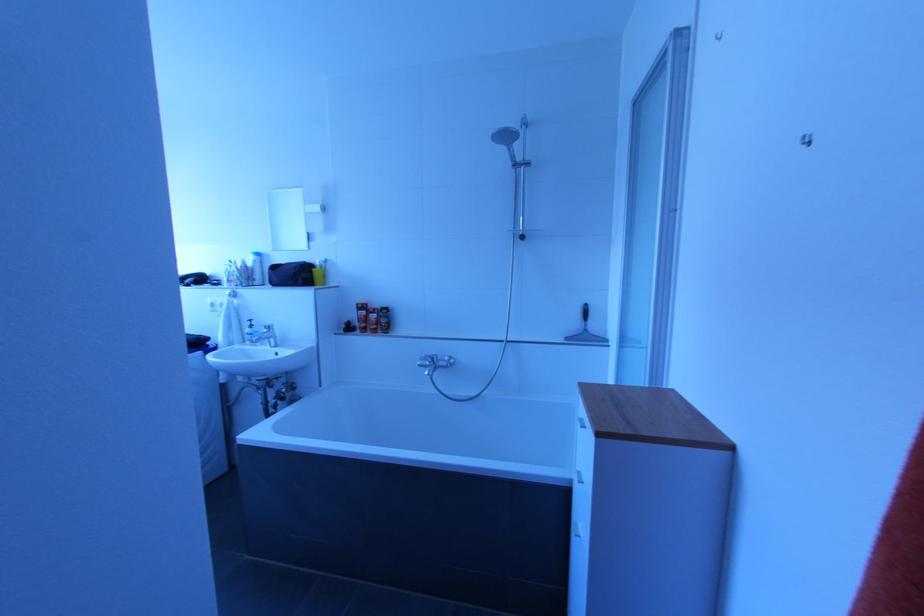
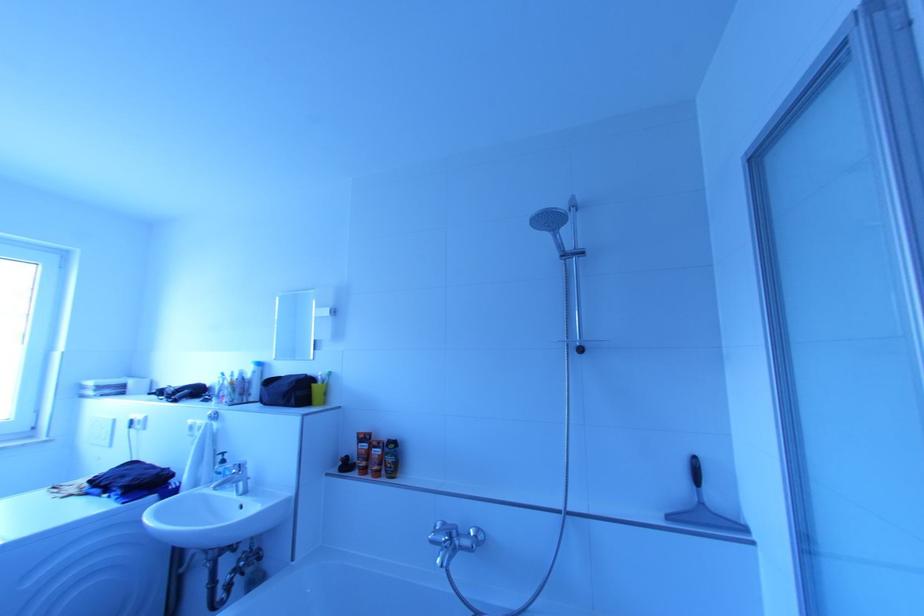
Question: In a continuous first-person perspective shot, in which direction is the camera moving?

Choices:
 (A) Left
 (B) Right
 (C) Forward
 (D) Backward

Answer: (C)